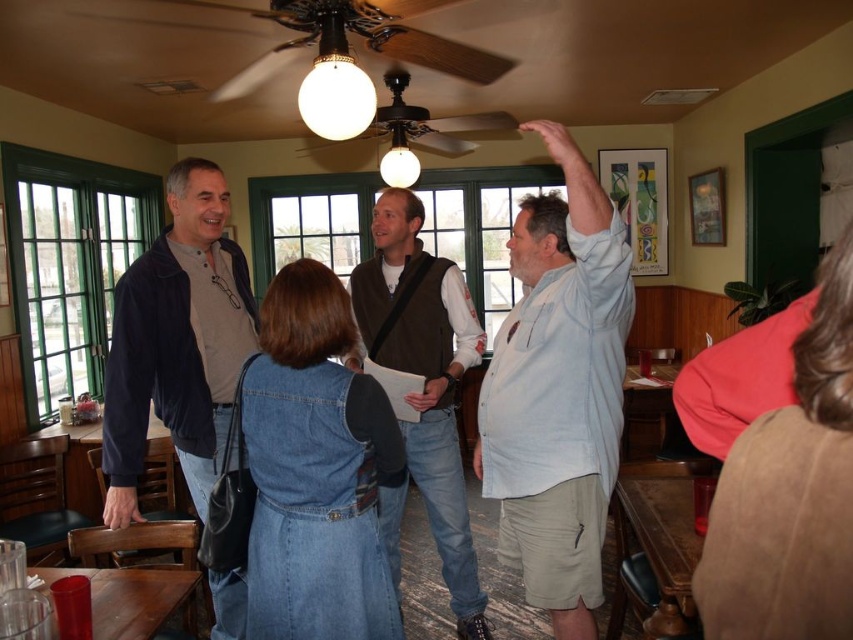
Question: Among these points, which one is farthest from the camera?

Choices:
 (A) (509, 129)
 (B) (549, 552)

Answer: (A)

Question: Can you confirm if pink fabric at upper right is thinner than brown suede vest at center?

Choices:
 (A) no
 (B) yes

Answer: (B)

Question: Can you confirm if light blue cotton shirt at upper right is wider than dark blue velvety jacket at left?

Choices:
 (A) yes
 (B) no

Answer: (B)

Question: Among these points, which one is farthest from the camera?

Choices:
 (A) (383, 260)
 (B) (395, 104)
 (C) (407, 52)

Answer: (B)

Question: Does denim dress at center appear on the right side of wooden ceiling fan at upper center?

Choices:
 (A) yes
 (B) no

Answer: (A)

Question: Which object is positioned closest to the brown suede vest at center?

Choices:
 (A) pink fabric at upper right
 (B) white glass globe at upper center
 (C) wooden ceiling fan at upper center
 (D) light blue cotton shirt at upper right

Answer: (D)